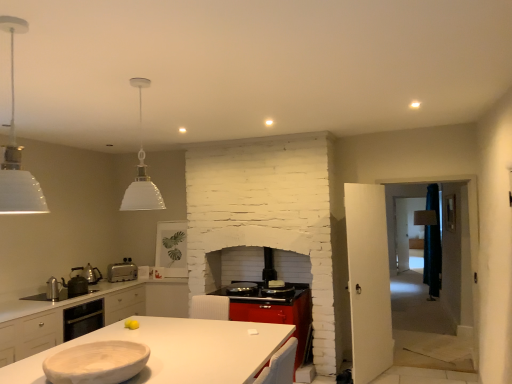
Where is `matte black kettle at left, the second appliance positioned from the back`? This screenshot has width=512, height=384. matte black kettle at left, the second appliance positioned from the back is located at coordinates (76, 284).

What is the approximate width of matte silver kettle at left, the first appliance viewed from the back?

matte silver kettle at left, the first appliance viewed from the back, is 9.87 inches wide.

Image resolution: width=512 pixels, height=384 pixels. I want to click on metallic silver kettle at left, the 1th appliance in the front-to-back sequence, so click(x=53, y=289).

Find the location of a particular element. The width and height of the screenshot is (512, 384). white glass pendant lamp at upper center, the 2th light fixture viewed from the front is located at coordinates (141, 171).

What do you see at coordinates (141, 171) in the screenshot?
I see `white glass pendant lamp at upper center, the 2th light fixture viewed from the front` at bounding box center [141, 171].

Image resolution: width=512 pixels, height=384 pixels. What do you see at coordinates (17, 152) in the screenshot? I see `white matte pendant light at upper left, the second light fixture when ordered from back to front` at bounding box center [17, 152].

Identify the location of matte black kettle at left, the second appliance positioned from the back. (76, 284).

Could you tell me if metallic silver kettle at left, the 1th appliance in the front-to-back sequence, is facing silver metallic toaster at lower left?

No, metallic silver kettle at left, the 1th appliance in the front-to-back sequence, is not aimed at silver metallic toaster at lower left.

Considering the sizes of metallic silver kettle at left, the 3th appliance from the back, and silver metallic toaster at lower left in the image, is metallic silver kettle at left, the 3th appliance from the back, wider or thinner than silver metallic toaster at lower left?

metallic silver kettle at left, the 3th appliance from the back, is thinner than silver metallic toaster at lower left.

Is point (53, 276) positioned after point (115, 279)?

No.

Consider the image. Does white matte countertop at center have a larger size compared to silver metallic toaster at lower left?

Yes.

In the image, is white matte countertop at center positioned in front of or behind silver metallic toaster at lower left?

In the image, white matte countertop at center appears in front of silver metallic toaster at lower left.

How many degrees apart are the facing directions of white matte countertop at center and silver metallic toaster at lower left?

39.5 degrees.

Does white matte countertop at center turn towards silver metallic toaster at lower left?

No, white matte countertop at center is not aimed at silver metallic toaster at lower left.

Measure the distance between white glass pendant lamp at upper center, the 2th light fixture viewed from the front, and silver metallic toaster at lower left.

1.23 meters.

Looking at this image, from the image's perspective, would you say white glass pendant lamp at upper center, the 2th light fixture viewed from the front, is shown under silver metallic toaster at lower left?

No, from the image's perspective, white glass pendant lamp at upper center, the 2th light fixture viewed from the front, is not below silver metallic toaster at lower left.

From a real-world perspective, which object rests below the other?

silver metallic toaster at lower left.

Can you tell me how much white glass pendant lamp at upper center, which is the 1th light fixture from back to front, and silver metallic toaster at lower left differ in facing direction?

They differ by 49.4 degrees in their facing directions.

Considering the positions of objects matte silver kettle at left, the first appliance viewed from the back, and metallic silver kettle at left, the 3th appliance from the back, in the image provided, who is more to the right, matte silver kettle at left, the first appliance viewed from the back, or metallic silver kettle at left, the 3th appliance from the back,?

Positioned to the right is matte silver kettle at left, the first appliance viewed from the back.

From the image's perspective, is matte silver kettle at left, the first appliance viewed from the back, located beneath metallic silver kettle at left, the 1th appliance in the front-to-back sequence?

Indeed, from the image's perspective, matte silver kettle at left, the first appliance viewed from the back, is shown beneath metallic silver kettle at left, the 1th appliance in the front-to-back sequence.

Which of these two, matte silver kettle at left, which is the 3th appliance from front to back, or metallic silver kettle at left, the 1th appliance in the front-to-back sequence, is smaller?

Smaller between the two is metallic silver kettle at left, the 1th appliance in the front-to-back sequence.

In the image, is matte silver kettle at left, which is the 3th appliance from front to back, positioned in front of or behind metallic silver kettle at left, the 3th appliance from the back?

Clearly, matte silver kettle at left, which is the 3th appliance from front to back, is behind metallic silver kettle at left, the 3th appliance from the back.

From a real-world perspective, starting from the white glass pendant lamp at upper center, the 2th light fixture viewed from the front, which appliance is the 2nd one below it? Please provide its 2D coordinates.

[(76, 284)]

Consider the image. From the image's perspective, which one is positioned higher, matte black kettle at left, the second appliance positioned from the back, or white glass pendant lamp at upper center, which is the 1th light fixture from back to front?

white glass pendant lamp at upper center, which is the 1th light fixture from back to front, appears higher in the image.

Does matte black kettle at left, which appears as the second appliance when viewed from the front, have a lesser width compared to white glass pendant lamp at upper center, the 2th light fixture viewed from the front?

Indeed, matte black kettle at left, which appears as the second appliance when viewed from the front, has a lesser width compared to white glass pendant lamp at upper center, the 2th light fixture viewed from the front.

From the picture: Would you say silver metallic toaster at lower left is to the left or to the right of white matte bowl at lower left in the picture?

Based on their positions, silver metallic toaster at lower left is located to the left of white matte bowl at lower left.

Can you tell me how much silver metallic toaster at lower left and white matte bowl at lower left differ in facing direction?

The angular difference between silver metallic toaster at lower left and white matte bowl at lower left is 40.8 degrees.

Is silver metallic toaster at lower left oriented towards white matte bowl at lower left?

Yes, silver metallic toaster at lower left is aimed at white matte bowl at lower left.

Is silver metallic toaster at lower left not close to white matte bowl at lower left?

silver metallic toaster at lower left is positioned a significant distance from white matte bowl at lower left.

Can you confirm if matte black kettle at left, which appears as the second appliance when viewed from the front, is thinner than white matte countertop at center?

Indeed, matte black kettle at left, which appears as the second appliance when viewed from the front, has a lesser width compared to white matte countertop at center.

Does matte black kettle at left, the second appliance positioned from the back, turn towards white matte countertop at center?

No, matte black kettle at left, the second appliance positioned from the back, does not turn towards white matte countertop at center.

Which is correct: matte black kettle at left, which appears as the second appliance when viewed from the front, is inside white matte countertop at center, or outside of it?

matte black kettle at left, which appears as the second appliance when viewed from the front, is spatially situated outside white matte countertop at center.

Locate an element on the screen. Image resolution: width=512 pixels, height=384 pixels. the 3rd appliance counting from the left side of the silver metallic toaster at lower left is located at coordinates (53, 289).

This screenshot has width=512, height=384. Find the location of `kitchen appliance lying above the white matte countertop at center (from the image's perspective)`. kitchen appliance lying above the white matte countertop at center (from the image's perspective) is located at coordinates (121, 272).

Estimate the real-world distances between objects in this image. Which object is closer to silver metallic toaster at lower left, white matte bowl at lower left or white matte countertop at center?

white matte countertop at center is closer to silver metallic toaster at lower left.

Which object lies nearer to the anchor point metallic silver kettle at left, the 3th appliance from the back, white matte pendant light at upper left, the first light fixture positioned from the front, or silver metallic toaster at lower left?

The object closer to metallic silver kettle at left, the 3th appliance from the back, is silver metallic toaster at lower left.

Based on their spatial positions, is matte black kettle at left, which appears as the second appliance when viewed from the front, or white matte bowl at lower left closer to matte silver kettle at left, which is the 3th appliance from front to back?

matte black kettle at left, which appears as the second appliance when viewed from the front, lies closer to matte silver kettle at left, which is the 3th appliance from front to back, than the other object.

Considering their positions, is metallic silver kettle at left, the 3th appliance from the back, positioned further to white matte pendant light at upper left, the first light fixture positioned from the front, than matte silver kettle at left, the first appliance viewed from the back?

matte silver kettle at left, the first appliance viewed from the back, lies further to white matte pendant light at upper left, the first light fixture positioned from the front, than the other object.

Estimate the real-world distances between objects in this image. Which object is closer to silver metallic toaster at lower left, white matte pendant light at upper left, the first light fixture positioned from the front, or white matte bowl at lower left?

white matte pendant light at upper left, the first light fixture positioned from the front, lies closer to silver metallic toaster at lower left than the other object.

Based on their spatial positions, is metallic silver kettle at left, the 3th appliance from the back, or silver metallic toaster at lower left further from white matte bowl at lower left?

The object further to white matte bowl at lower left is silver metallic toaster at lower left.

From the image, which object appears to be nearer to matte silver kettle at left, which is the 3th appliance from front to back, matte black kettle at left, the second appliance positioned from the back, or white matte pendant light at upper left, the first light fixture positioned from the front?

Among the two, matte black kettle at left, the second appliance positioned from the back, is located nearer to matte silver kettle at left, which is the 3th appliance from front to back.

When comparing their distances from white matte bowl at lower left, does metallic silver kettle at left, the 1th appliance in the front-to-back sequence, or matte silver kettle at left, which is the 3th appliance from front to back, seem closer?

metallic silver kettle at left, the 1th appliance in the front-to-back sequence, lies closer to white matte bowl at lower left than the other object.

Find the location of a particular element. light fixture between white matte pendant light at upper left, the first light fixture positioned from the front, and silver metallic toaster at lower left from front to back is located at coordinates click(141, 171).

Where is `tableware positioned between white matte pendant light at upper left, the second light fixture when ordered from back to front, and matte silver kettle at left, which is the 3th appliance from front to back, from near to far`? tableware positioned between white matte pendant light at upper left, the second light fixture when ordered from back to front, and matte silver kettle at left, which is the 3th appliance from front to back, from near to far is located at coordinates (97, 363).

Image resolution: width=512 pixels, height=384 pixels. In order to click on appliance between white matte countertop at center and matte black kettle at left, the second appliance positioned from the back, along the z-axis in this screenshot , I will do `click(53, 289)`.

Where is `light fixture between white matte pendant light at upper left, the second light fixture when ordered from back to front, and white matte bowl at lower left vertically`? The image size is (512, 384). light fixture between white matte pendant light at upper left, the second light fixture when ordered from back to front, and white matte bowl at lower left vertically is located at coordinates (141, 171).